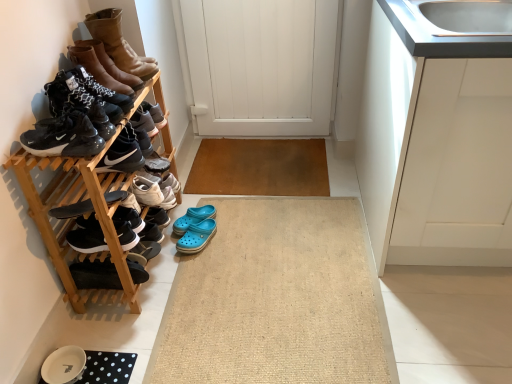
Where is `vacant space that's between wooden shoe rack at left and beige woven bath mat at center`? vacant space that's between wooden shoe rack at left and beige woven bath mat at center is located at coordinates (151, 288).